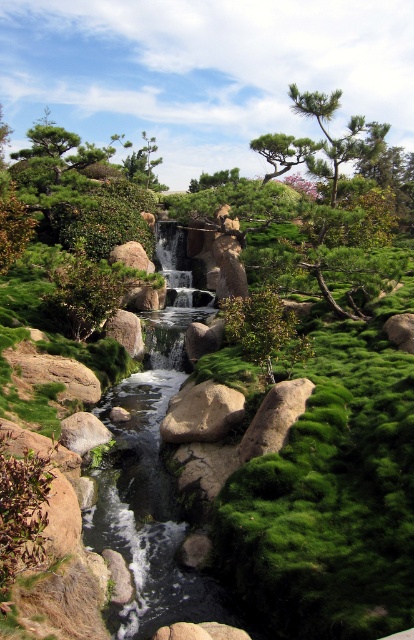
Who is more distant from viewer, (x=70, y=145) or (x=211, y=424)?

Point (x=70, y=145)

I want to click on green mossy tree at upper left, so click(x=53, y=156).

Does gray rock at center come behind green mossy rock at center?

Yes, gray rock at center is further from the viewer.

Can you confirm if gray rock at center is positioned to the right of green mossy rock at center?

Incorrect, gray rock at center is not on the right side of green mossy rock at center.

Find the location of a particular element. gray rock at center is located at coordinates (202, 413).

Is green mossy tree at upper left wider than green mossy rock at center?

Correct, the width of green mossy tree at upper left exceeds that of green mossy rock at center.

Is point (45, 177) behind point (293, 387)?

Yes, point (45, 177) is behind point (293, 387).

The image size is (414, 640). I want to click on green mossy tree at upper left, so click(x=53, y=156).